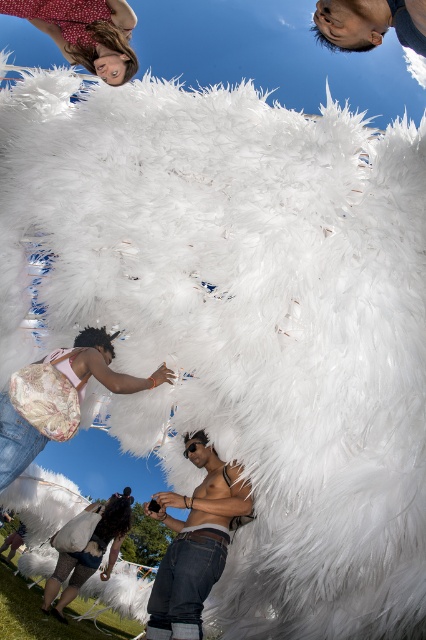
Which is behind, point (51, 29) or point (423, 17)?

The point (51, 29) is more distant.

Between matte red dress at upper left and smooth skin head at upper right, which one is positioned higher?

matte red dress at upper left is above.

You are a GUI agent. You are given a task and a screenshot of the screen. Output one action in this format:
    pyautogui.click(x=<x>, y=<y>)
    Task: Click on the matte red dress at upper left
    
    Given the screenshot: What is the action you would take?
    pyautogui.click(x=85, y=33)

Where is `shiny metallic phone at center`? The image size is (426, 640). shiny metallic phone at center is located at coordinates (195, 541).

Does point (215, 474) come closer to viewer compared to point (20, 467)?

No, (215, 474) is further to viewer.

Who is more forward, (184, 451) or (13, 422)?

Positioned in front is point (13, 422).

This screenshot has height=640, width=426. I want to click on shiny metallic phone at center, so click(x=195, y=541).

Between matte red dress at upper left and leather backpack at lower left, which one has more height?

leather backpack at lower left

Is point (83, 42) positioned behind point (80, 340)?

No, it is in front of (80, 340).

Is point (78, 54) positioned after point (89, 356)?

No.

At what (x,y) coordinates should I click in order to perform the action: click on matte red dress at upper left. Please return your answer as a coordinate pair (x, y). This screenshot has width=426, height=640. Looking at the image, I should click on (85, 33).